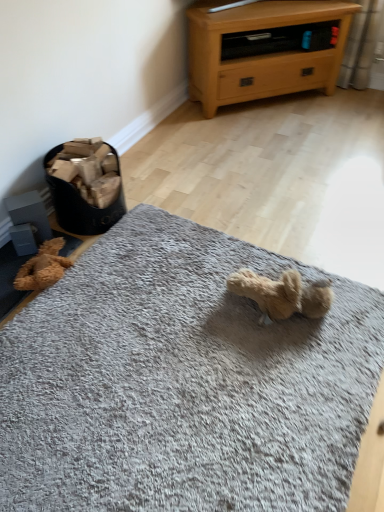
This screenshot has height=512, width=384. Identify the location of free space in front of light oak wood chest of drawers at upper right. (271, 140).